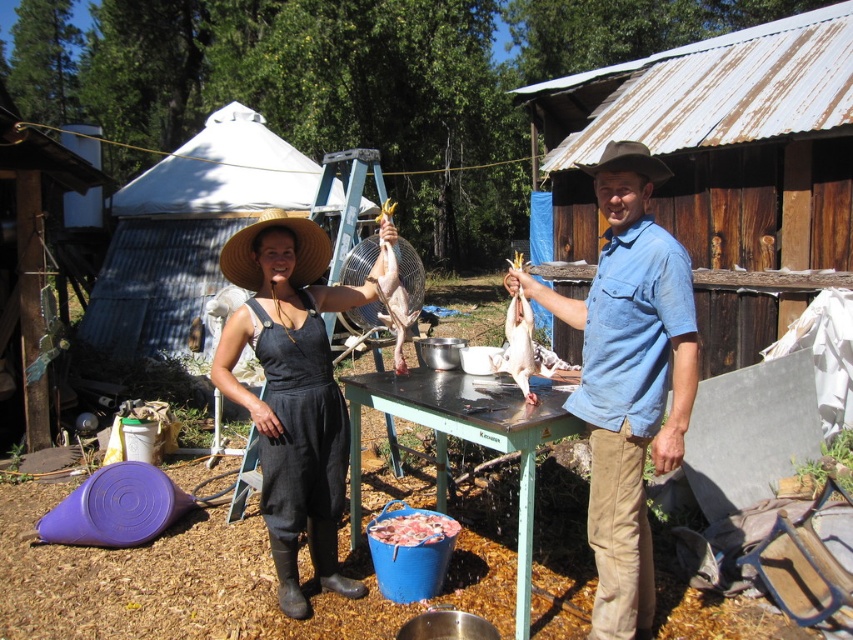
Question: Which object is farther from the camera taking this photo?

Choices:
 (A) raw pink meat at center
 (B) blue denim shirt at center
 (C) green painted wood table at center

Answer: (A)

Question: Which object is positioned farthest from the brown felt cowboy hat at center?

Choices:
 (A) raw pink meat at center
 (B) shiny silver fish at center
 (C) smooth skin duck at center

Answer: (A)

Question: Can you confirm if black cotton dress at center is smaller than shiny silver fish at center?

Choices:
 (A) yes
 (B) no

Answer: (B)

Question: Does blue denim shirt at center come behind straw hat at center?

Choices:
 (A) yes
 (B) no

Answer: (B)

Question: Which of the following is the farthest from the observer?

Choices:
 (A) (399, 387)
 (B) (236, 275)
 (C) (659, 244)

Answer: (A)

Question: Is black cotton dress at center thinner than green painted wood table at center?

Choices:
 (A) yes
 (B) no

Answer: (A)